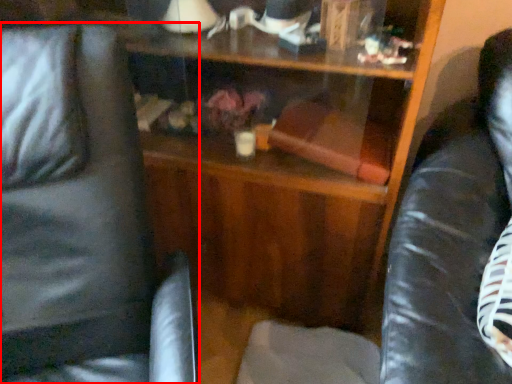
Question: From the image's perspective, what is the correct spatial relationship of swivel chair (annotated by the red box) in relation to swivel chair?

Choices:
 (A) below
 (B) above

Answer: (A)